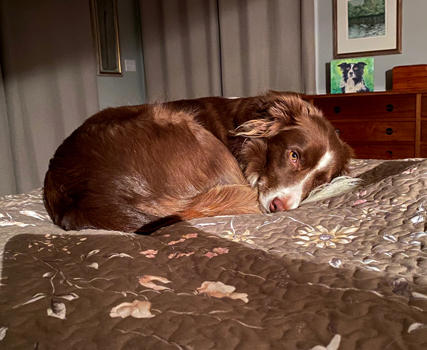
Identify the location of knobs. (387, 130), (387, 106), (389, 153), (334, 111), (335, 128).